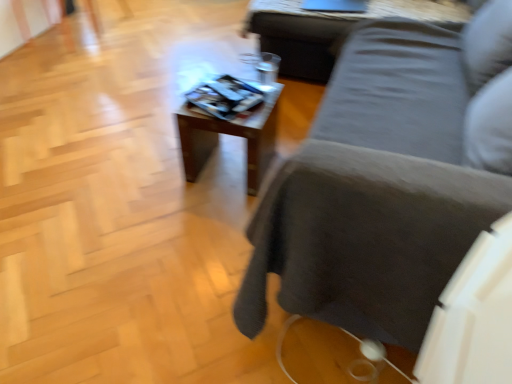
Identify the location of vacant space in front of wooden table at center, which is the 2th table in back-to-front order. The image size is (512, 384). (206, 218).